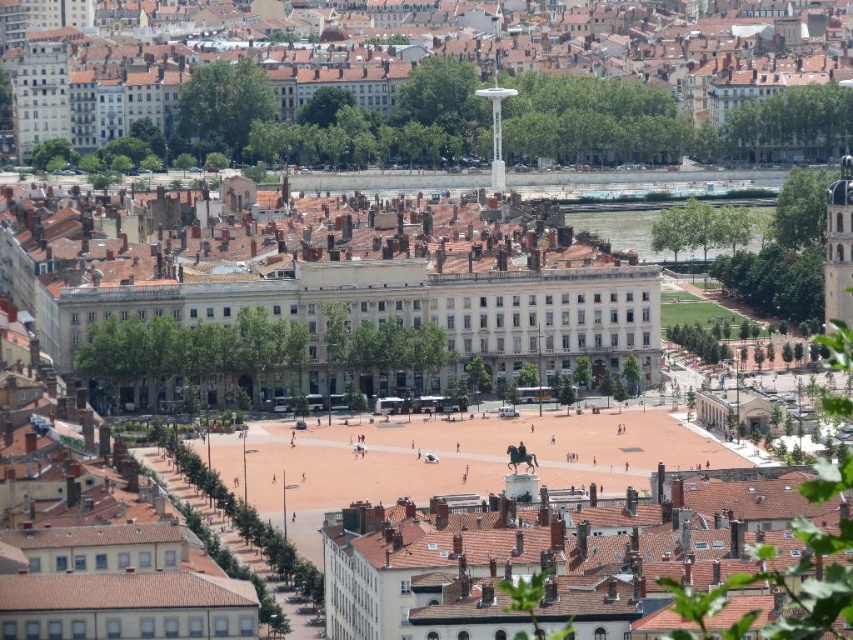
Is white glossy building at center to the right of white smooth building at center from the viewer's perspective?

Indeed, white glossy building at center is positioned on the right side of white smooth building at center.

In the scene shown: Can you confirm if white glossy building at center is wider than white smooth building at center?

Indeed, white glossy building at center has a greater width compared to white smooth building at center.

Is point (590, 67) positioned in front of point (276, 276)?

No, (590, 67) is further to viewer.

Find the location of a particular element. Image resolution: width=853 pixels, height=640 pixels. white glossy building at center is located at coordinates (438, 92).

Based on the photo, can you confirm if white glossy building at center is shorter than brown tiled roof at center?

In fact, white glossy building at center may be taller than brown tiled roof at center.

Which of these two, white glossy building at center or brown tiled roof at center, stands shorter?

With less height is brown tiled roof at center.

Does point (477, 38) lie behind point (366, 618)?

Yes, point (477, 38) is farther from viewer.

I want to click on white glossy building at center, so click(438, 92).

Can you confirm if white smooth building at center is bigger than brown tiled roof at center?

Yes.

Who is more distant from viewer, (82,269) or (495,570)?

Point (82,269)

In order to click on white smooth building at center in this screenshot , I will do `click(341, 307)`.